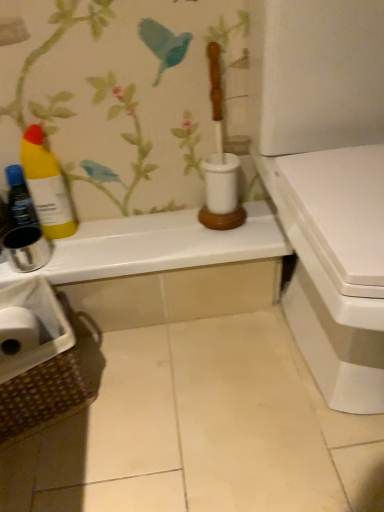
The width and height of the screenshot is (384, 512). I want to click on free space in front of yellow matte bottle at left, which is the 2th bottle from left to right, so click(69, 256).